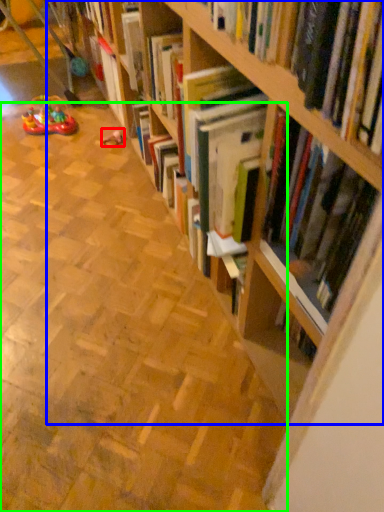
Question: Which is nearer to the toy (highlighted by a red box)? bookcase (highlighted by a blue box) or aisle (highlighted by a green box).

Choices:
 (A) bookcase
 (B) aisle

Answer: (B)